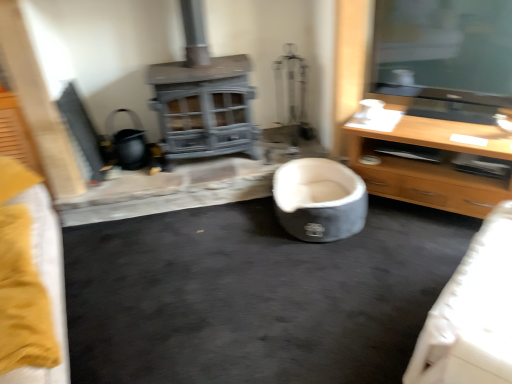
I want to click on soft gray fabric bean bag at center, so click(319, 200).

What do you see at coordinates (319, 200) in the screenshot? I see `soft gray fabric bean bag at center` at bounding box center [319, 200].

Measure the distance between light wood/finish tv stand at right and camera.

light wood/finish tv stand at right and camera are 6.62 feet apart from each other.

This screenshot has width=512, height=384. Describe the element at coordinates (432, 165) in the screenshot. I see `light wood/finish tv stand at right` at that location.

Locate an element on the screen. light wood/finish tv stand at right is located at coordinates (432, 165).

Identify the location of soft gray fabric bean bag at center. (319, 200).

Does light wood/finish tv stand at right appear on the right side of soft gray fabric bean bag at center?

Correct, you'll find light wood/finish tv stand at right to the right of soft gray fabric bean bag at center.

Is the position of light wood/finish tv stand at right more distant than that of soft gray fabric bean bag at center?

No, it is not.

Is point (397, 183) positioned before point (339, 238)?

No, it is not.

From the image's perspective, does light wood/finish tv stand at right appear higher than soft gray fabric bean bag at center?

Yes, from the image's perspective, light wood/finish tv stand at right is above soft gray fabric bean bag at center.

From a real-world perspective, is light wood/finish tv stand at right positioned under soft gray fabric bean bag at center based on gravity?

Actually, light wood/finish tv stand at right is physically above soft gray fabric bean bag at center in the real world.

Looking at this image, does light wood/finish tv stand at right have a greater width compared to soft gray fabric bean bag at center?

Correct, the width of light wood/finish tv stand at right exceeds that of soft gray fabric bean bag at center.

Between light wood/finish tv stand at right and soft gray fabric bean bag at center, which one has less height?

soft gray fabric bean bag at center.

Who is bigger, light wood/finish tv stand at right or soft gray fabric bean bag at center?

Bigger between the two is light wood/finish tv stand at right.

Consider the image. Is soft gray fabric bean bag at center completely or partially inside light wood/finish tv stand at right?

No, soft gray fabric bean bag at center is not a part of light wood/finish tv stand at right.

Is light wood/finish tv stand at right beside soft gray fabric bean bag at center?

No, light wood/finish tv stand at right is not with soft gray fabric bean bag at center.

Is light wood/finish tv stand at right oriented towards soft gray fabric bean bag at center?

Yes, light wood/finish tv stand at right is oriented towards soft gray fabric bean bag at center.

How many degrees apart are the facing directions of light wood/finish tv stand at right and soft gray fabric bean bag at center?

They differ by 40.4 degrees in their facing directions.

The width and height of the screenshot is (512, 384). What are the coordinates of `bean bag chair behind the light wood/finish tv stand at right` in the screenshot? It's located at coord(319,200).

Considering the relative positions of soft gray fabric bean bag at center and light wood/finish tv stand at right in the image provided, is soft gray fabric bean bag at center to the left of light wood/finish tv stand at right from the viewer's perspective?

Yes.

Which object is closer to the camera taking this photo, soft gray fabric bean bag at center or light wood/finish tv stand at right?

light wood/finish tv stand at right is more forward.

Is point (327, 164) closer or farther from the camera than point (442, 207)?

Point (327, 164) is positioned farther from the camera compared to point (442, 207).

From the image's perspective, is soft gray fabric bean bag at center located above or below light wood/finish tv stand at right?

From the image's perspective, soft gray fabric bean bag at center appears below light wood/finish tv stand at right.

From a real-world perspective, which object rests below the other?

In real-world perspective, soft gray fabric bean bag at center is lower.

Considering the sizes of soft gray fabric bean bag at center and light wood/finish tv stand at right in the image, is soft gray fabric bean bag at center wider or thinner than light wood/finish tv stand at right?

In the image, soft gray fabric bean bag at center appears to be more narrow than light wood/finish tv stand at right.

Is soft gray fabric bean bag at center taller than light wood/finish tv stand at right?

No.

Which of these two, soft gray fabric bean bag at center or light wood/finish tv stand at right, is smaller?

soft gray fabric bean bag at center.

Would you say soft gray fabric bean bag at center is outside light wood/finish tv stand at right?

Yes.

Is the surface of soft gray fabric bean bag at center in direct contact with light wood/finish tv stand at right?

No, soft gray fabric bean bag at center is not in contact with light wood/finish tv stand at right.

Could you tell me if soft gray fabric bean bag at center is facing light wood/finish tv stand at right?

No, soft gray fabric bean bag at center does not turn towards light wood/finish tv stand at right.

Consider the image. How much distance is there between soft gray fabric bean bag at center and light wood/finish tv stand at right?

soft gray fabric bean bag at center and light wood/finish tv stand at right are 14.21 inches apart from each other.

Where is `bean bag chair below the light wood/finish tv stand at right (from a real-world perspective)`? bean bag chair below the light wood/finish tv stand at right (from a real-world perspective) is located at coordinates tap(319, 200).

This screenshot has height=384, width=512. I want to click on bean bag chair that appears on the left of light wood/finish tv stand at right, so click(319, 200).

You are a GUI agent. You are given a task and a screenshot of the screen. Output one action in this format:
    pyautogui.click(x=<x>, y=<y>)
    Task: Click on the bean bag chair located below the light wood/finish tv stand at right (from the image's perspective)
    The image size is (512, 384).
    Given the screenshot: What is the action you would take?
    pyautogui.click(x=319, y=200)